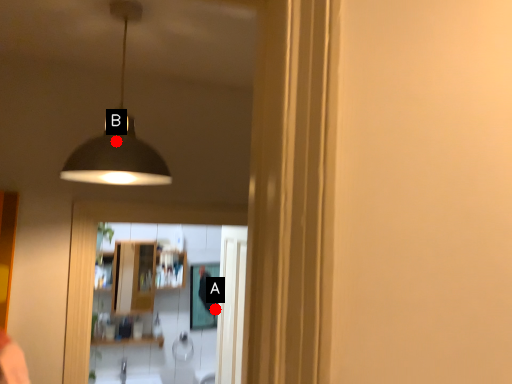
Question: Two points are circled on the image, labeled by A and B beside each circle. Which point is further to the camera?

Choices:
 (A) A is further
 (B) B is further

Answer: (A)